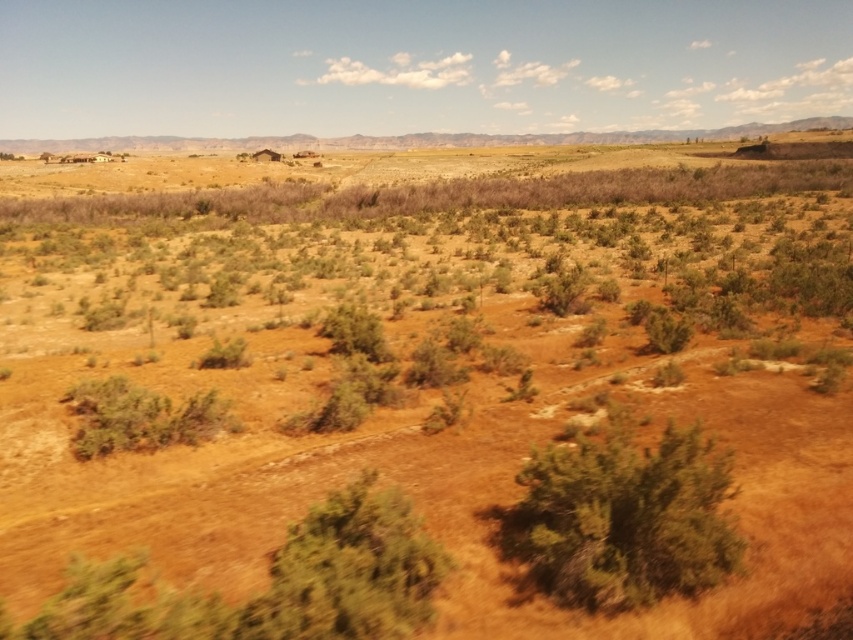
You are standing at the origin point of the coordinate system in the image. You want to walk to the green leafy bush at center. Which direction should you move in terms of x and y coordinates?

You should move towards the positive x and positive y direction since the green leafy bush at center is located at coordinate point (624,518).

You are standing in the middle of the arid landscape and see the green leafy bush at center and the green leafy bush at lower center. Which one is closer to your feet?

The green leafy bush at lower center is closer to your feet because it is positioned lower in the image, indicating it is nearer to the observer.